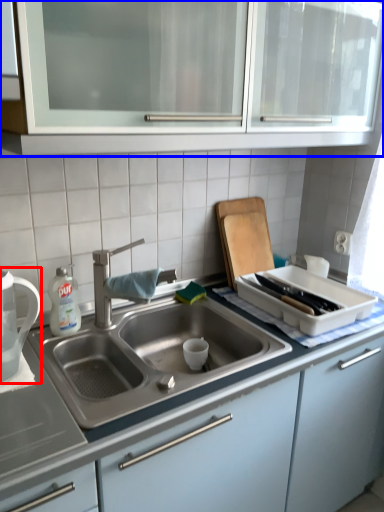
Question: Among these objects, which one is nearest to the camera, tea pot (highlighted by a red box) or cabinetry (highlighted by a blue box)?

Choices:
 (A) tea pot
 (B) cabinetry

Answer: (B)